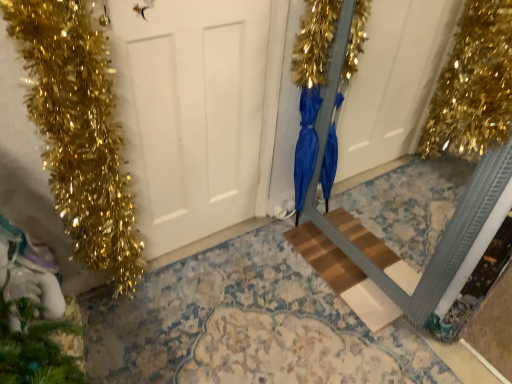
Question: Is blue satin dress at center smaller than green matte pine cone at lower left?

Choices:
 (A) no
 (B) yes

Answer: (A)

Question: Does blue satin dress at center have a lesser width compared to green matte pine cone at lower left?

Choices:
 (A) no
 (B) yes

Answer: (B)

Question: Does blue satin dress at center appear on the right side of green matte pine cone at lower left?

Choices:
 (A) yes
 (B) no

Answer: (A)

Question: Can you confirm if blue satin dress at center is wider than green matte pine cone at lower left?

Choices:
 (A) yes
 (B) no

Answer: (B)

Question: Does blue satin dress at center appear on the left side of green matte pine cone at lower left?

Choices:
 (A) yes
 (B) no

Answer: (B)

Question: From a real-world perspective, is blue satin dress at center positioned over green matte pine cone at lower left based on gravity?

Choices:
 (A) yes
 (B) no

Answer: (A)

Question: From the image's perspective, is green matte pine cone at lower left beneath wooden step at center?

Choices:
 (A) yes
 (B) no

Answer: (A)

Question: Is green matte pine cone at lower left with wooden step at center?

Choices:
 (A) no
 (B) yes

Answer: (A)

Question: Can you confirm if green matte pine cone at lower left is thinner than wooden step at center?

Choices:
 (A) no
 (B) yes

Answer: (B)

Question: Does green matte pine cone at lower left appear on the right side of wooden step at center?

Choices:
 (A) yes
 (B) no

Answer: (B)

Question: Is green matte pine cone at lower left shorter than wooden step at center?

Choices:
 (A) yes
 (B) no

Answer: (B)

Question: Is green matte pine cone at lower left closer to the viewer compared to wooden step at center?

Choices:
 (A) no
 (B) yes

Answer: (B)

Question: Can you confirm if white matte door at center is smaller than blue satin dress at center?

Choices:
 (A) yes
 (B) no

Answer: (B)